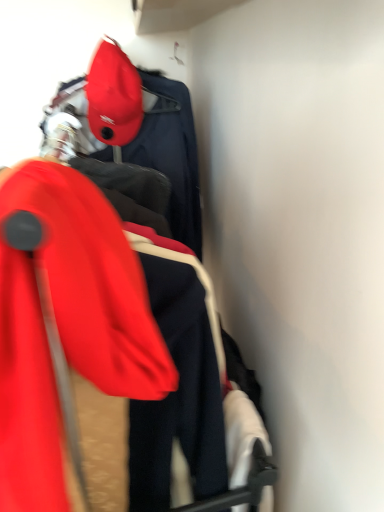
Question: From the image's perspective, relative to matte red cap at upper left, is matte red ski jacket at left above or below?

Choices:
 (A) above
 (B) below

Answer: (B)

Question: Looking at the image, does matte red ski jacket at left seem bigger or smaller compared to matte red cap at upper left?

Choices:
 (A) small
 (B) big

Answer: (B)

Question: From a real-world perspective, is matte red ski jacket at left physically located above or below matte red cap at upper left?

Choices:
 (A) below
 (B) above

Answer: (A)

Question: Does point (110, 99) appear closer or farther from the camera than point (18, 461)?

Choices:
 (A) farther
 (B) closer

Answer: (A)

Question: From a real-world perspective, relative to matte red ski jacket at left, is matte red cap at upper left vertically above or below?

Choices:
 (A) above
 (B) below

Answer: (A)

Question: Would you say matte red cap at upper left is inside or outside matte red ski jacket at left?

Choices:
 (A) outside
 (B) inside

Answer: (A)

Question: From their relative heights in the image, would you say matte red cap at upper left is taller or shorter than matte red ski jacket at left?

Choices:
 (A) tall
 (B) short

Answer: (B)